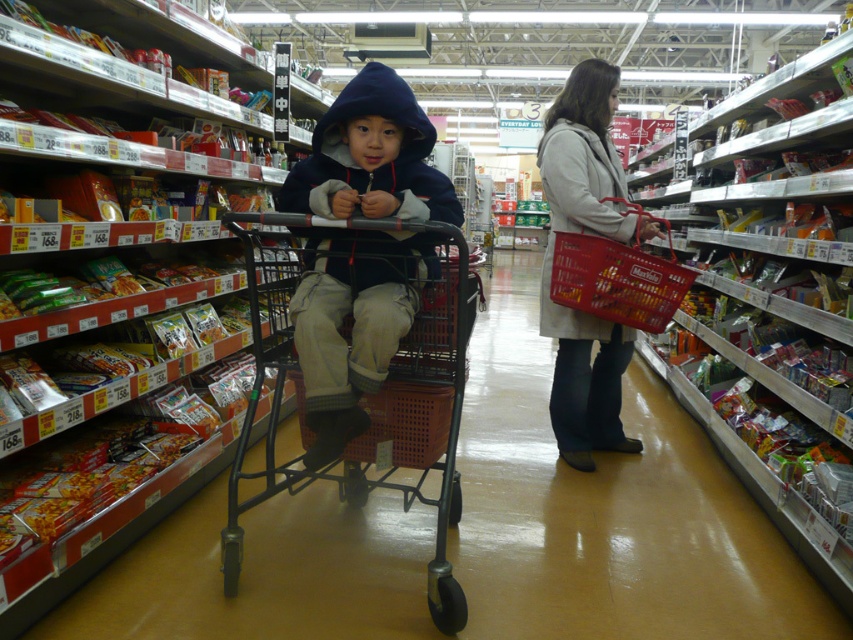
You are a delivery person who needs to place a package between the metallic shopping cart at center and the gray wool coat at center in the supermarket aisle. The package requires a minimum of 1 meter of space to fit. Can you fit the package between them?

The distance between the metallic shopping cart at center and the gray wool coat at center is 1.18 meters, which is more than the required 1 meter. Therefore, the package can be placed between them.